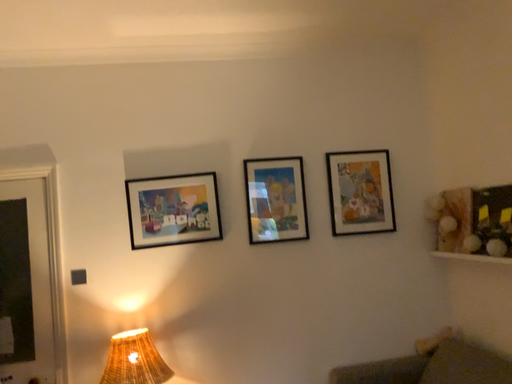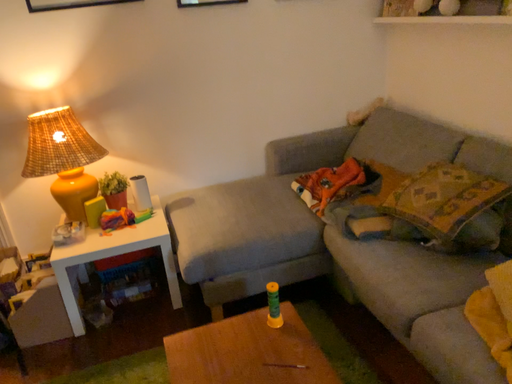
Question: How did the camera likely rotate when shooting the video?

Choices:
 (A) rotated right
 (B) rotated left

Answer: (A)